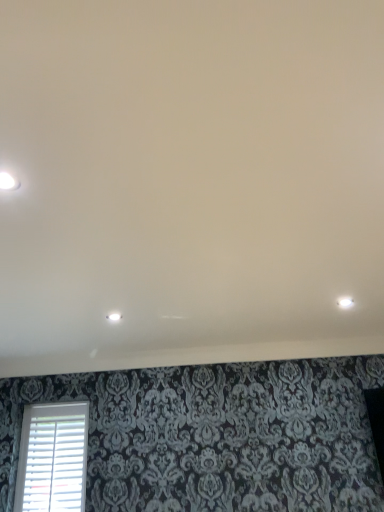
What do you see at coordinates (114, 316) in the screenshot? I see `white glossy light fixture at center, which is the 1th dot in back-to-front order` at bounding box center [114, 316].

Measure the distance between white glossy light fixture at center, arranged as the second dot when viewed from the front, and camera.

The depth of white glossy light fixture at center, arranged as the second dot when viewed from the front, is 2.40 meters.

Locate an element on the screen. white glossy light fixture at upper left, placed as the first dot when sorted from top to bottom is located at coordinates (8, 181).

Identify the location of white matte ceiling at upper center. The width and height of the screenshot is (384, 512). (190, 183).

Based on the photo, considering the relative positions of white glossy light fixture at center, which ranks as the 1th dot in bottom-to-top order, and white plastic blinds at lower left in the image provided, is white glossy light fixture at center, which ranks as the 1th dot in bottom-to-top order, to the left or to the right of white plastic blinds at lower left?

From the image, it's evident that white glossy light fixture at center, which ranks as the 1th dot in bottom-to-top order, is to the right of white plastic blinds at lower left.

Which object is further away from the camera taking this photo, white glossy light fixture at center, placed as the second dot when sorted from left to right, or white plastic blinds at lower left?

white plastic blinds at lower left is further from the camera.

Are white glossy light fixture at center, which is the 1th dot in back-to-front order, and white plastic blinds at lower left beside each other?

No, white glossy light fixture at center, which is the 1th dot in back-to-front order, is not touching white plastic blinds at lower left.

Is point (110, 317) less distant than point (88, 402)?

That is True.

Can you tell me how much white glossy light fixture at center, placed as the second dot when sorted from left to right, and white glossy light fixture at upper left, placed as the 1th dot when sorted from left to right, differ in facing direction?

white glossy light fixture at center, placed as the second dot when sorted from left to right, and white glossy light fixture at upper left, placed as the 1th dot when sorted from left to right, are facing 180 degrees away from each other.

In the scene shown: Is white glossy light fixture at center, which is the 1th dot in back-to-front order, in front of or behind white glossy light fixture at upper left, placed as the first dot when sorted from top to bottom, in the image?

Clearly, white glossy light fixture at center, which is the 1th dot in back-to-front order, is behind white glossy light fixture at upper left, placed as the first dot when sorted from top to bottom.

Which of these two, white glossy light fixture at center, placed as the first dot when sorted from right to left, or white glossy light fixture at upper left, acting as the second dot starting from the right, is bigger?

white glossy light fixture at center, placed as the first dot when sorted from right to left, is bigger.

Is point (108, 315) closer to viewer compared to point (6, 176)?

No, (108, 315) is further to viewer.

Between white glossy light fixture at upper left, which ranks as the 1th dot in front-to-back order, and white glossy light fixture at center, which is the 1th dot in back-to-front order, which one has smaller size?

Smaller between the two is white glossy light fixture at upper left, which ranks as the 1th dot in front-to-back order.

Where is `dot below the white glossy light fixture at center, which is the 1th dot in back-to-front order (from a real-world perspective)`? The image size is (384, 512). dot below the white glossy light fixture at center, which is the 1th dot in back-to-front order (from a real-world perspective) is located at coordinates (8, 181).

Is there a large distance between white glossy light fixture at upper left, acting as the second dot starting from the right, and white glossy light fixture at center, which ranks as the 1th dot in bottom-to-top order?

Absolutely, white glossy light fixture at upper left, acting as the second dot starting from the right, is distant from white glossy light fixture at center, which ranks as the 1th dot in bottom-to-top order.

How much distance is there between white glossy light fixture at upper left, placed as the first dot when sorted from top to bottom, and white glossy light fixture at center, placed as the second dot when sorted from left to right?

A distance of 4.22 feet exists between white glossy light fixture at upper left, placed as the first dot when sorted from top to bottom, and white glossy light fixture at center, placed as the second dot when sorted from left to right.

Is white plastic blinds at lower left at the right side of white matte ceiling at upper center?

In fact, white plastic blinds at lower left is to the left of white matte ceiling at upper center.

Between white plastic blinds at lower left and white matte ceiling at upper center, which one has less height?

Standing shorter between the two is white matte ceiling at upper center.

Between white plastic blinds at lower left and white matte ceiling at upper center, which one has larger width?

Wider between the two is white matte ceiling at upper center.

Is white plastic blinds at lower left spatially inside white matte ceiling at upper center, or outside of it?

white plastic blinds at lower left exists outside the volume of white matte ceiling at upper center.

How many degrees apart are the facing directions of white matte ceiling at upper center and white plastic blinds at lower left?

90.2 degrees separate the facing orientations of white matte ceiling at upper center and white plastic blinds at lower left.

Is white matte ceiling at upper center looking in the opposite direction of white plastic blinds at lower left?

white matte ceiling at upper center does not have its back to white plastic blinds at lower left.

Between white matte ceiling at upper center and white plastic blinds at lower left, which one has more height?

Result: white plastic blinds at lower left.

Which point is more distant from viewer, [285,214] or [21,456]?

Point [21,456]

Could you tell me if white matte ceiling at upper center is facing white glossy light fixture at center, placed as the first dot when sorted from right to left?

No, white matte ceiling at upper center is not facing towards white glossy light fixture at center, placed as the first dot when sorted from right to left.

Do you think white matte ceiling at upper center is within white glossy light fixture at center, which is the 1th dot in back-to-front order, or outside of it?

white matte ceiling at upper center is located beyond the bounds of white glossy light fixture at center, which is the 1th dot in back-to-front order.

The width and height of the screenshot is (384, 512). In order to click on backdrop that is under the white glossy light fixture at center, arranged as the second dot when viewed from the front (from a real-world perspective) in this screenshot , I will do [x=190, y=183].

Who is shorter, white matte ceiling at upper center or white glossy light fixture at center, which ranks as the 1th dot in bottom-to-top order?

white glossy light fixture at center, which ranks as the 1th dot in bottom-to-top order, is shorter.

From a real-world perspective, is white glossy light fixture at upper left, placed as the 1th dot when sorted from left to right, physically below white plastic blinds at lower left?

No, from a real-world perspective, white glossy light fixture at upper left, placed as the 1th dot when sorted from left to right, is not beneath white plastic blinds at lower left.

Is white glossy light fixture at upper left, the 2th dot from the bottom, touching white plastic blinds at lower left?

No.

From the image's perspective, is white glossy light fixture at upper left, acting as the second dot starting from the right, located above or below white plastic blinds at lower left?

Clearly, from the image's perspective, white glossy light fixture at upper left, acting as the second dot starting from the right, is above white plastic blinds at lower left.

Where is `dot that is the 1st object to the right of the white plastic blinds at lower left, starting at the anchor`? dot that is the 1st object to the right of the white plastic blinds at lower left, starting at the anchor is located at coordinates (8, 181).

From the image's perspective, starting from the white plastic blinds at lower left, which dot is the 1st one above? Please provide its 2D coordinates.

[(114, 316)]

Find the location of a particular element. dot below the white glossy light fixture at upper left, which ranks as the 1th dot in front-to-back order (from the image's perspective) is located at coordinates (114, 316).

Which object lies further to the anchor point white glossy light fixture at center, which is the 1th dot in back-to-front order, white glossy light fixture at upper left, positioned as the 2th dot in back-to-front order, or white matte ceiling at upper center?

white glossy light fixture at upper left, positioned as the 2th dot in back-to-front order.

Estimate the real-world distances between objects in this image. Which object is further from white plastic blinds at lower left, white glossy light fixture at center, the 2th dot when ordered from top to bottom, or white glossy light fixture at upper left, acting as the second dot starting from the right?

Among the two, white glossy light fixture at upper left, acting as the second dot starting from the right, is located further to white plastic blinds at lower left.

Looking at the image, which one is located further to white glossy light fixture at center, which ranks as the 1th dot in bottom-to-top order, white matte ceiling at upper center or white plastic blinds at lower left?

white plastic blinds at lower left is further to white glossy light fixture at center, which ranks as the 1th dot in bottom-to-top order.

When comparing their distances from white glossy light fixture at upper left, placed as the 1th dot when sorted from left to right, does white plastic blinds at lower left or white matte ceiling at upper center seem further?

white plastic blinds at lower left is further to white glossy light fixture at upper left, placed as the 1th dot when sorted from left to right.

Considering their positions, is white glossy light fixture at center, placed as the second dot when sorted from left to right, positioned closer to white matte ceiling at upper center than white plastic blinds at lower left?

white glossy light fixture at center, placed as the second dot when sorted from left to right, lies closer to white matte ceiling at upper center than the other object.

Considering their positions, is white glossy light fixture at upper left, which ranks as the 1th dot in front-to-back order, positioned closer to white plastic blinds at lower left than white glossy light fixture at center, placed as the first dot when sorted from right to left?

Among the two, white glossy light fixture at center, placed as the first dot when sorted from right to left, is located nearer to white plastic blinds at lower left.

In the scene shown: Which object lies nearer to the anchor point white plastic blinds at lower left, white glossy light fixture at center, which is the 1th dot in back-to-front order, or white matte ceiling at upper center?

white glossy light fixture at center, which is the 1th dot in back-to-front order, is positioned closer to the anchor white plastic blinds at lower left.

Which object lies further to the anchor point white glossy light fixture at center, placed as the first dot when sorted from right to left, white matte ceiling at upper center or white glossy light fixture at upper left, acting as the second dot starting from the right?

white glossy light fixture at upper left, acting as the second dot starting from the right, is further to white glossy light fixture at center, placed as the first dot when sorted from right to left.

The width and height of the screenshot is (384, 512). I want to click on dot between white glossy light fixture at upper left, acting as the second dot starting from the right, and white plastic blinds at lower left, along the z-axis, so click(x=114, y=316).

This screenshot has width=384, height=512. I want to click on dot between white matte ceiling at upper center and white glossy light fixture at center, which is the 1th dot in back-to-front order, along the z-axis, so 8,181.